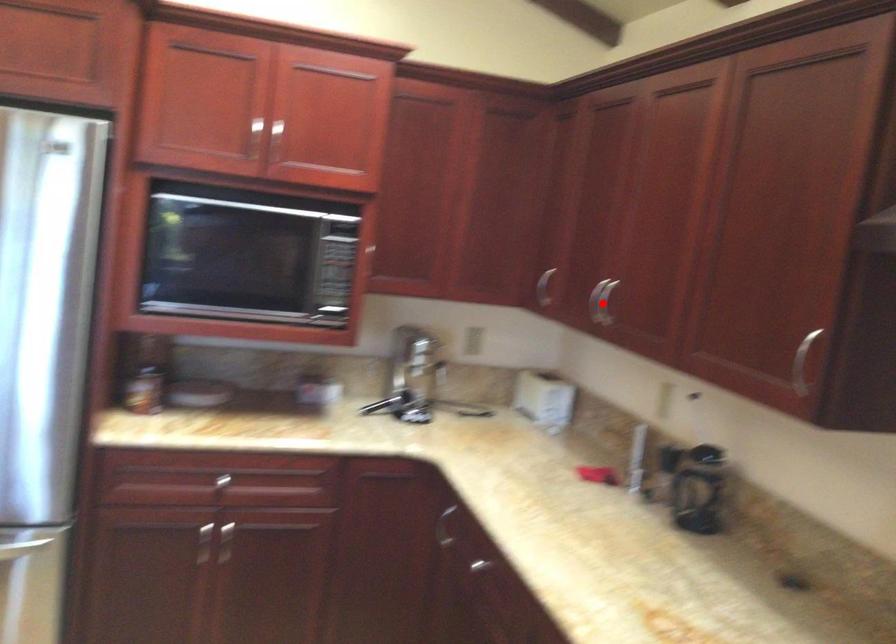
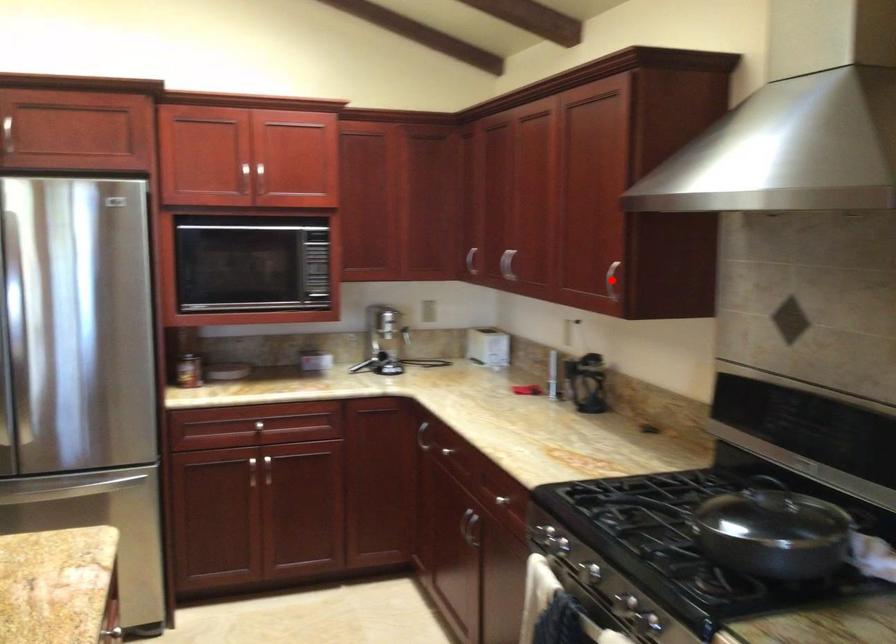
I am providing you with two images of the same scene from different viewpoints. A red point is marked on the first image and another point is marked on the second image. Does the point marked in image1 correspond to the same location as the one in image2?

No